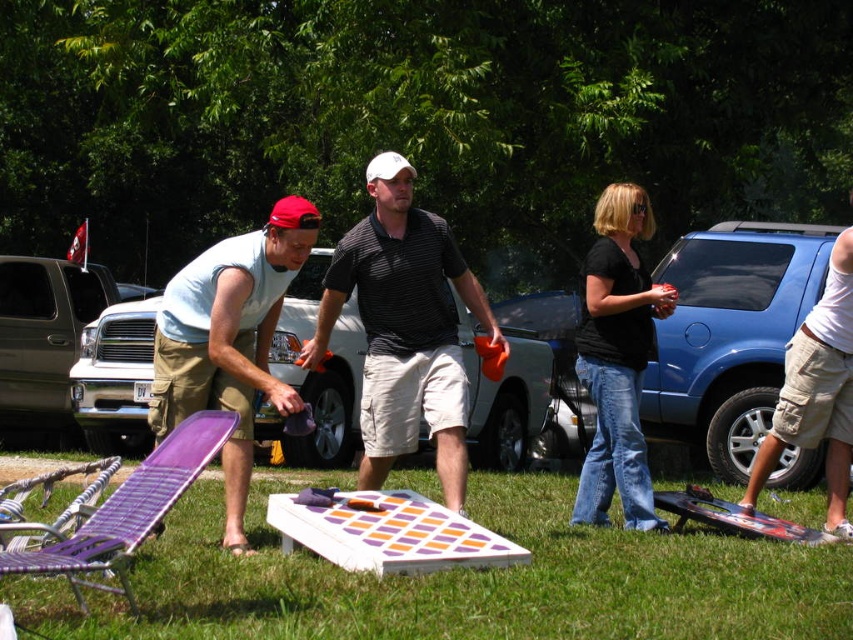
You are standing in the middle of the grassy area and want to place a picnic basket between the brushed metal truck at center and the black cotton shirt at center. Which direction should you move to place it correctly?

To place the picnic basket between the brushed metal truck at center and the black cotton shirt at center, you should move to the right of the brushed metal truck at center since it is to the left of the black cotton shirt at center.

You are a photographer setting up a tripod to capture the two men playing cornhole. The tripod has a maximum height adjustment of 1.6 meters. Given the height difference between the black striped polo shirt at center and the black cotton shirt at center, can you determine if the tripod will be tall enough to frame both subjects comfortably?

The black striped polo shirt at center is shorter than the black cotton shirt at center. Since the tripod has a maximum height of 1.6 meters, it should be sufficient to frame both subjects as long as the taller individual, the black cotton shirt at center, is under 1.6 meters in height. However, without knowing their exact heights, we can only confirm the tripod can accommodate their height difference but cannot guarantee it fits both entirely.